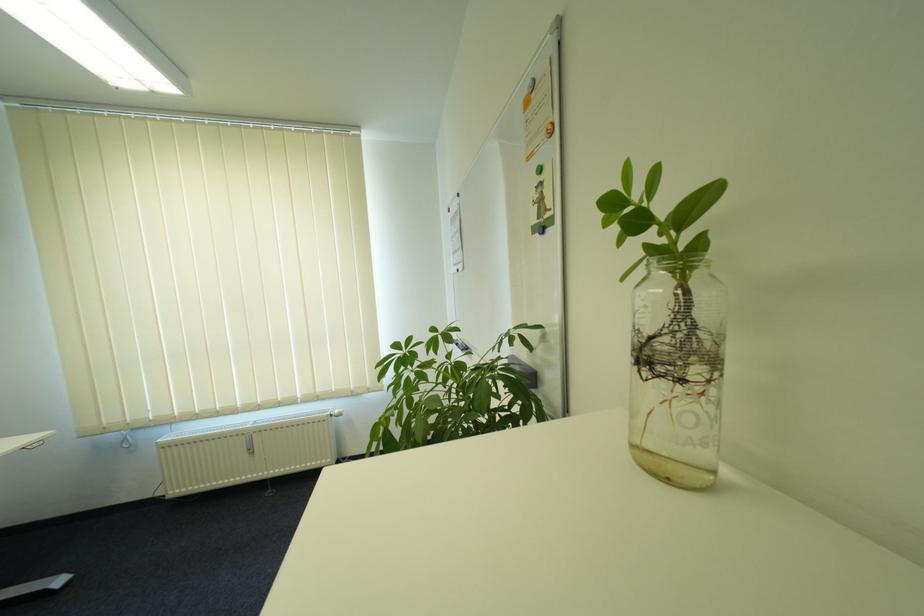
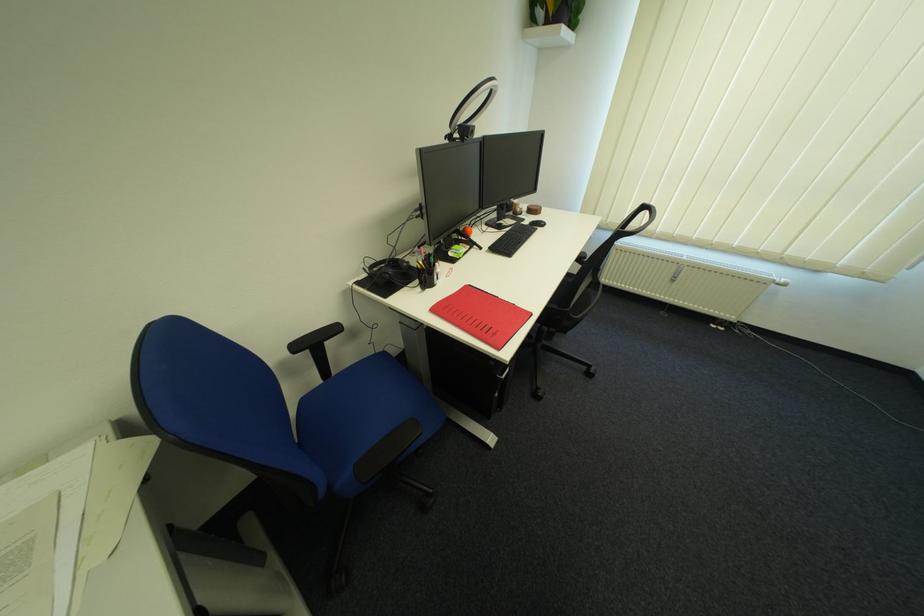
Where in the second image is the point corresponding to point 346,411 from the first image?

(793, 281)